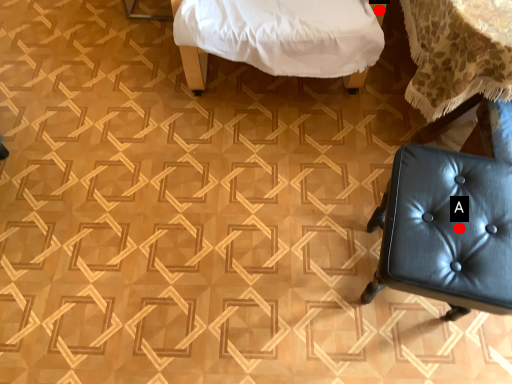
Question: Two points are circled on the image, labeled by A and B beside each circle. Which of the following is the farthest from the observer?

Choices:
 (A) A is further
 (B) B is further

Answer: (B)